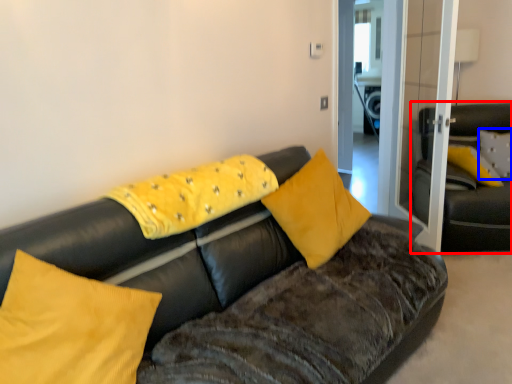
Question: Among these objects, which one is nearest to the camera, studio couch (highlighted by a red box) or pillow (highlighted by a blue box)?

Choices:
 (A) studio couch
 (B) pillow

Answer: (A)